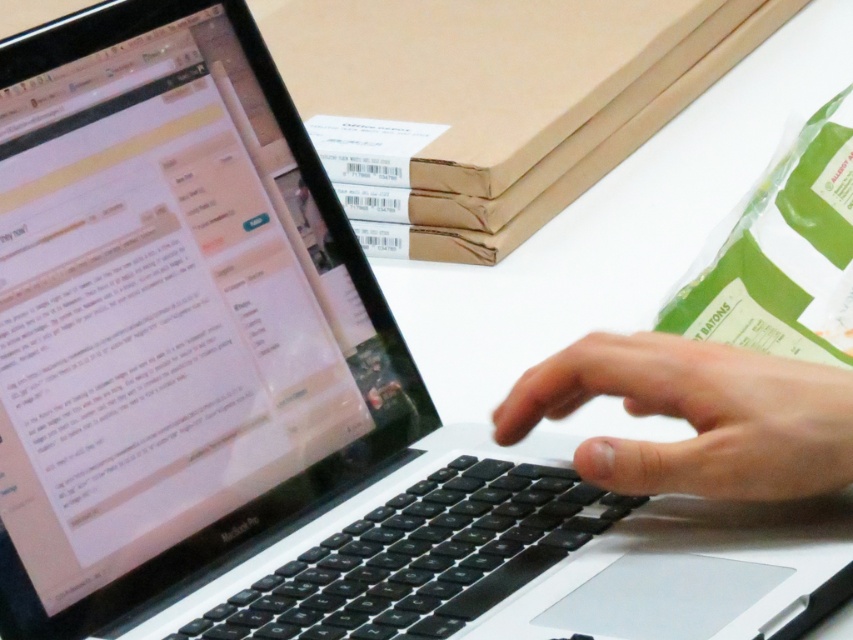
Question: Which object appears farthest from the camera in this image?

Choices:
 (A) black matte keyboard at center
 (B) black matte laptop at left

Answer: (B)

Question: Can you confirm if black matte keyboard at center is smaller than black matte hand at center?

Choices:
 (A) yes
 (B) no

Answer: (B)

Question: Is the position of black matte keyboard at center less distant than that of black matte hand at center?

Choices:
 (A) no
 (B) yes

Answer: (A)

Question: Which point is closer to the camera?

Choices:
 (A) black matte hand at center
 (B) black matte laptop at left
 (C) black matte keyboard at center

Answer: (A)

Question: Which object is the closest to the black matte laptop at left?

Choices:
 (A) black matte hand at center
 (B) black matte keyboard at center

Answer: (B)

Question: Is black matte laptop at left positioned behind black matte keyboard at center?

Choices:
 (A) no
 (B) yes

Answer: (B)